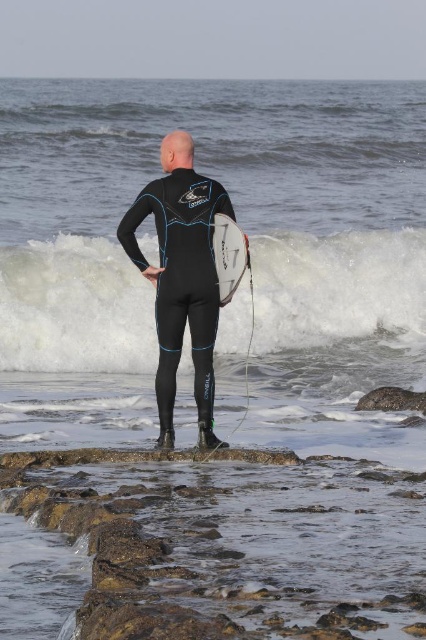
Question: Does white foam wave at center appear on the left side of white matte surfboard at center?

Choices:
 (A) no
 (B) yes

Answer: (A)

Question: Does white foam wave at center appear over black matte wetsuit at center?

Choices:
 (A) yes
 (B) no

Answer: (B)

Question: Which point appears farthest from the camera in this image?

Choices:
 (A) (184, 224)
 (B) (221, 225)
 (C) (376, 248)

Answer: (C)

Question: Among these points, which one is nearest to the camera?

Choices:
 (A) (328, 256)
 (B) (172, 145)

Answer: (B)

Question: Estimate the real-world distances between objects in this image. Which object is closer to the white matte surfboard at center?

Choices:
 (A) black matte wetsuit at center
 (B) white foam wave at center

Answer: (A)

Question: Is white foam wave at center above black matte wetsuit at center?

Choices:
 (A) no
 (B) yes

Answer: (A)